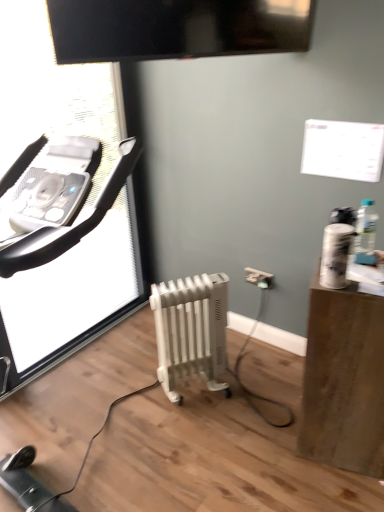
Locate an element on the screen. This screenshot has width=384, height=512. vacant position to the left of brown wood side table at right is located at coordinates (263, 447).